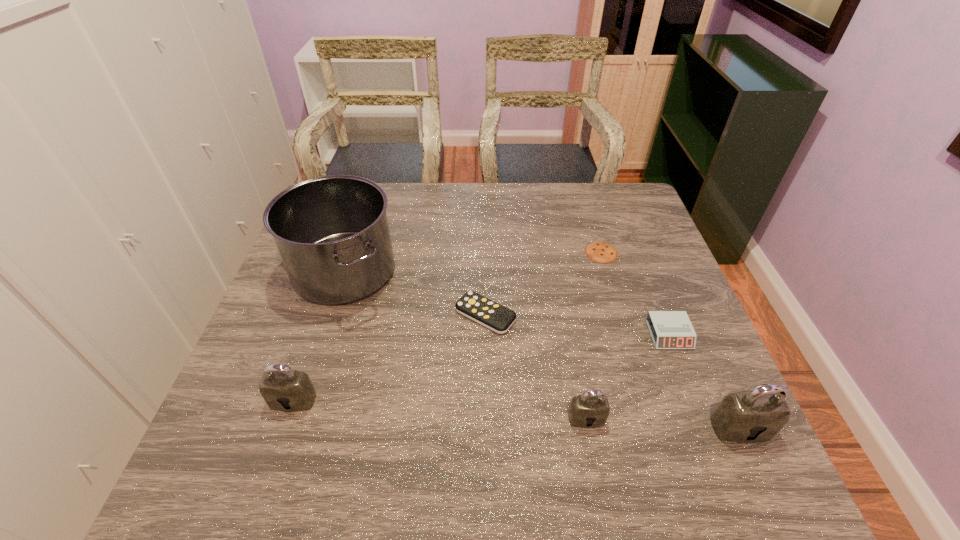
Identify the location of empty space that is in between the leftmost padlock and the tallest object. pos(319,336).

Where is `empty location between the sixth tallest object and the rightmost padlock`? Image resolution: width=960 pixels, height=540 pixels. empty location between the sixth tallest object and the rightmost padlock is located at coordinates (612, 372).

Where is `free space between the remote control and the third tallest object`? free space between the remote control and the third tallest object is located at coordinates (390, 357).

I want to click on vacant region between the rightmost padlock and the second shortest object, so click(612, 372).

The height and width of the screenshot is (540, 960). I want to click on empty space between the fifth tallest object and the cookie, so click(x=636, y=293).

Find the location of `blank region between the alarm clock and the fourth object from right to left`. blank region between the alarm clock and the fourth object from right to left is located at coordinates (628, 376).

You are a GUI agent. You are given a task and a screenshot of the screen. Output one action in this format:
    pyautogui.click(x=<x>, y=<y>)
    Task: Click on the vacant region between the cookie and the tallest object
    The image size is (960, 540).
    Given the screenshot: What is the action you would take?
    pyautogui.click(x=473, y=262)

Identify the location of vacant region between the saucepan and the shortest object. Image resolution: width=960 pixels, height=540 pixels. (473, 262).

Where is `vacant space in between the third object from left to right and the saucepan`? The image size is (960, 540). vacant space in between the third object from left to right and the saucepan is located at coordinates (415, 293).

You are a GUI agent. You are given a task and a screenshot of the screen. Output one action in this format:
    pyautogui.click(x=<x>, y=<y>)
    Task: Click on the vacant space that's between the fifth object from right to left and the fifth tallest object
    
    Given the screenshot: What is the action you would take?
    pyautogui.click(x=577, y=325)